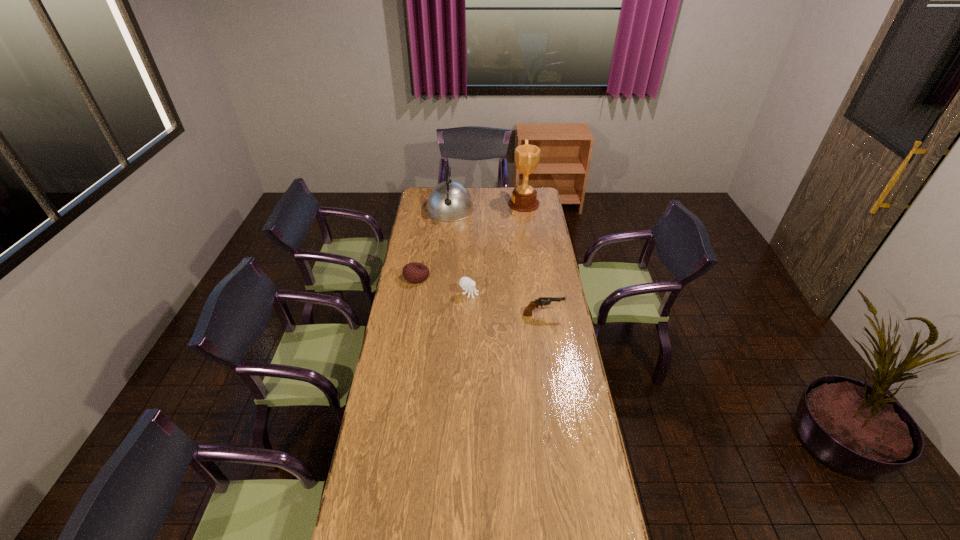
At what (x,y) coordinates should I click in order to perform the action: click on free space located 0.050m on the front-facing side of the octopus. Please return your answer as a coordinate pair (x, y). This screenshot has width=960, height=540. Looking at the image, I should click on (489, 294).

Find the location of `free location located 0.340m on the front of the shortest object`. free location located 0.340m on the front of the shortest object is located at coordinates (407, 336).

At what (x,y) coordinates should I click in order to perform the action: click on award that is at the far edge. Please return your answer as a coordinate pair (x, y). Looking at the image, I should click on (524, 197).

Where is `kettle that is at the far edge`? This screenshot has height=540, width=960. kettle that is at the far edge is located at coordinates (449, 201).

Image resolution: width=960 pixels, height=540 pixels. In order to click on kettle that is at the left edge in this screenshot , I will do `click(449, 201)`.

This screenshot has width=960, height=540. I want to click on beanbag that is positioned at the left edge, so click(x=414, y=272).

You are a GUI agent. You are given a task and a screenshot of the screen. Output one action in this format:
    pyautogui.click(x=<x>, y=<y>)
    Task: Click on the award situated at the right edge
    Image resolution: width=960 pixels, height=540 pixels.
    Given the screenshot: What is the action you would take?
    click(524, 197)

Identify the location of gun located at the right edge. (542, 301).

Find the location of a particular element. This screenshot has width=960, height=540. object at the far left corner is located at coordinates (449, 201).

Find the location of `object located at the far right corner`. object located at the far right corner is located at coordinates (x=524, y=197).